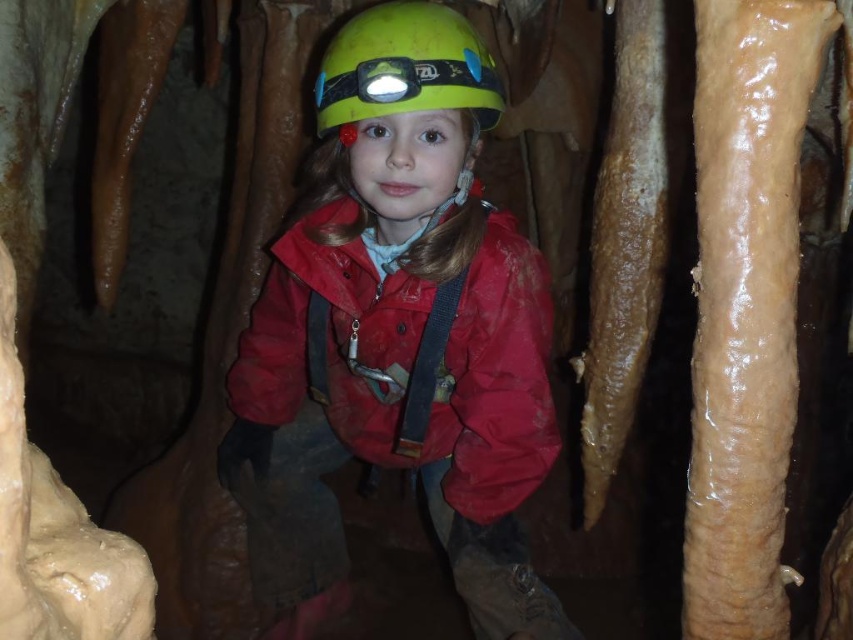
Question: Is matte red jacket at center below green matte helmet at center?

Choices:
 (A) yes
 (B) no

Answer: (A)

Question: Which point is farther to the camera?

Choices:
 (A) matte red jacket at center
 (B) green matte helmet at center
 (C) yellow matte helmet at center

Answer: (A)

Question: Based on their relative distances, which object is farther from the yellow matte helmet at center?

Choices:
 (A) matte red jacket at center
 (B) green matte helmet at center

Answer: (A)

Question: Does matte red jacket at center have a smaller size compared to green matte helmet at center?

Choices:
 (A) yes
 (B) no

Answer: (B)

Question: Which point appears closest to the camera in this image?

Choices:
 (A) (279, 593)
 (B) (396, 81)

Answer: (B)

Question: Is matte red jacket at center positioned before yellow matte helmet at center?

Choices:
 (A) yes
 (B) no

Answer: (B)